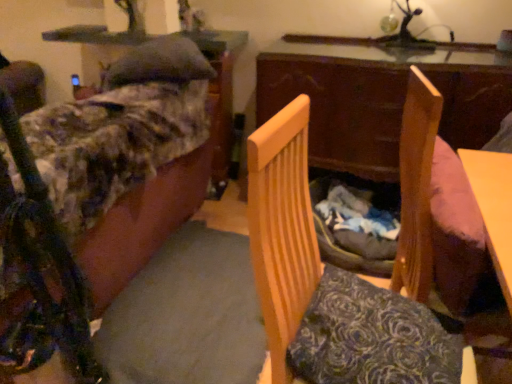
Question: Does fluffy fabric couch at left, positioned as the second furniture in right-to-left order, have a greater width compared to wooden swivel chair at right?

Choices:
 (A) yes
 (B) no

Answer: (A)

Question: Considering the relative positions of fluffy fabric couch at left, positioned as the second furniture in right-to-left order, and wooden swivel chair at right in the image provided, is fluffy fabric couch at left, positioned as the second furniture in right-to-left order, to the left of wooden swivel chair at right from the viewer's perspective?

Choices:
 (A) no
 (B) yes

Answer: (B)

Question: Is fluffy fabric couch at left, marked as the 1th furniture in a left-to-right arrangement, facing away from wooden swivel chair at right?

Choices:
 (A) no
 (B) yes

Answer: (B)

Question: From a real-world perspective, is fluffy fabric couch at left, marked as the 1th furniture in a left-to-right arrangement, below wooden swivel chair at right?

Choices:
 (A) no
 (B) yes

Answer: (B)

Question: Does fluffy fabric couch at left, marked as the 1th furniture in a left-to-right arrangement, have a larger size compared to wooden swivel chair at right?

Choices:
 (A) yes
 (B) no

Answer: (A)

Question: Is fluffy fabric couch at left, marked as the 1th furniture in a left-to-right arrangement, smaller than wooden swivel chair at right?

Choices:
 (A) yes
 (B) no

Answer: (B)

Question: Can you confirm if wooden chair at center, the 2th furniture viewed from the left, is smaller than fluffy fabric couch at left, marked as the 1th furniture in a left-to-right arrangement?

Choices:
 (A) yes
 (B) no

Answer: (A)

Question: Are wooden chair at center, the 2th furniture viewed from the left, and fluffy fabric couch at left, marked as the 1th furniture in a left-to-right arrangement, located far from each other?

Choices:
 (A) yes
 (B) no

Answer: (B)

Question: Can you confirm if wooden chair at center, the 2th furniture viewed from the left, is wider than fluffy fabric couch at left, positioned as the second furniture in right-to-left order?

Choices:
 (A) no
 (B) yes

Answer: (A)

Question: Does wooden chair at center, the 1th furniture positioned from the right, come behind fluffy fabric couch at left, marked as the 1th furniture in a left-to-right arrangement?

Choices:
 (A) no
 (B) yes

Answer: (A)

Question: Is wooden chair at center, the 2th furniture viewed from the left, to the left of fluffy fabric couch at left, marked as the 1th furniture in a left-to-right arrangement, from the viewer's perspective?

Choices:
 (A) yes
 (B) no

Answer: (B)

Question: From the image's perspective, is wooden chair at center, the 2th furniture viewed from the left, located beneath fluffy fabric couch at left, positioned as the second furniture in right-to-left order?

Choices:
 (A) no
 (B) yes

Answer: (B)

Question: From the image's perspective, would you say wooden chair at center, the 2th furniture viewed from the left, is shown under wooden swivel chair at right?

Choices:
 (A) no
 (B) yes

Answer: (B)